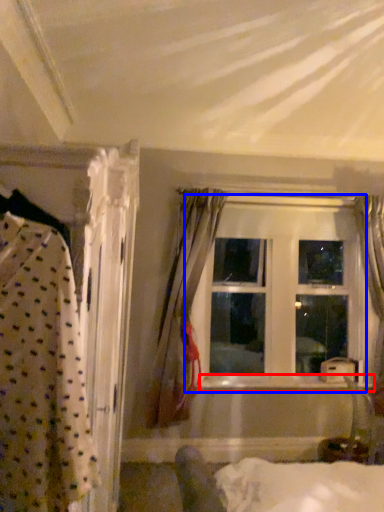
Question: Which point is further to the camera, window sill (highlighted by a red box) or window (highlighted by a blue box)?

Choices:
 (A) window sill
 (B) window

Answer: (B)